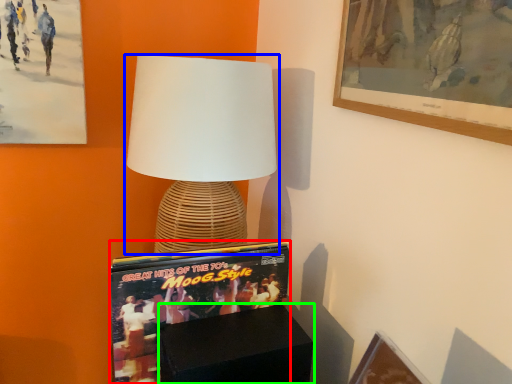
Question: Which object is the closest to the magazine (highlighted by a red box)? Choose among these: lamp (highlighted by a blue box) or furniture (highlighted by a green box).

Choices:
 (A) lamp
 (B) furniture

Answer: (B)